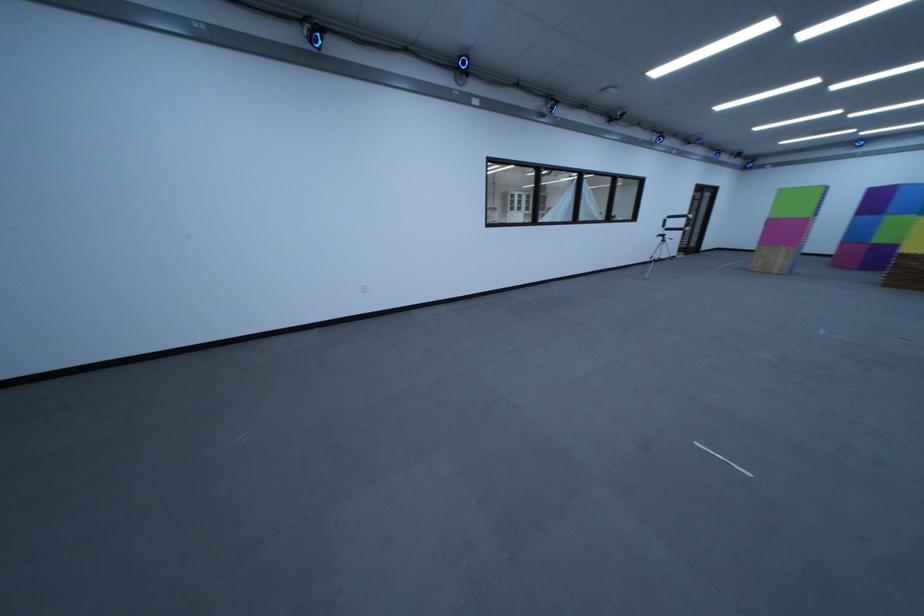
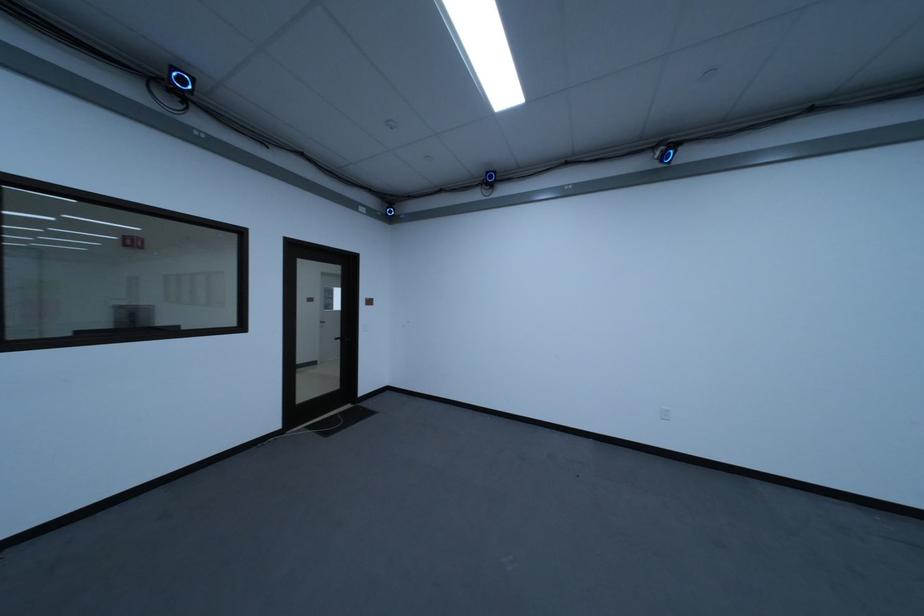
Question: The camera is either moving clockwise (left) or counter-clockwise (right) around the object. The first image is from the beginning of the video and the second image is from the end. Is the camera moving left or right when shooting the video?

Choices:
 (A) Left
 (B) Right

Answer: (B)